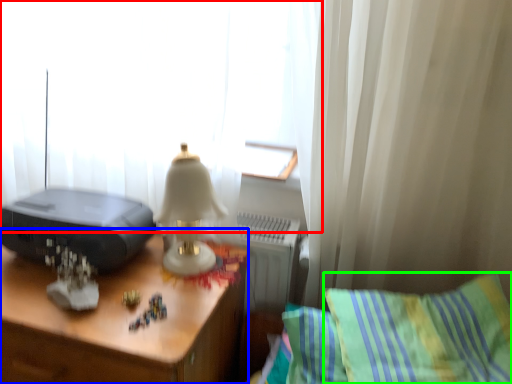
Question: Based on their relative distances, which object is farther from curtain (highlighted by a red box)? Choose from desk (highlighted by a blue box) and pillow (highlighted by a green box).

Choices:
 (A) desk
 (B) pillow

Answer: (B)